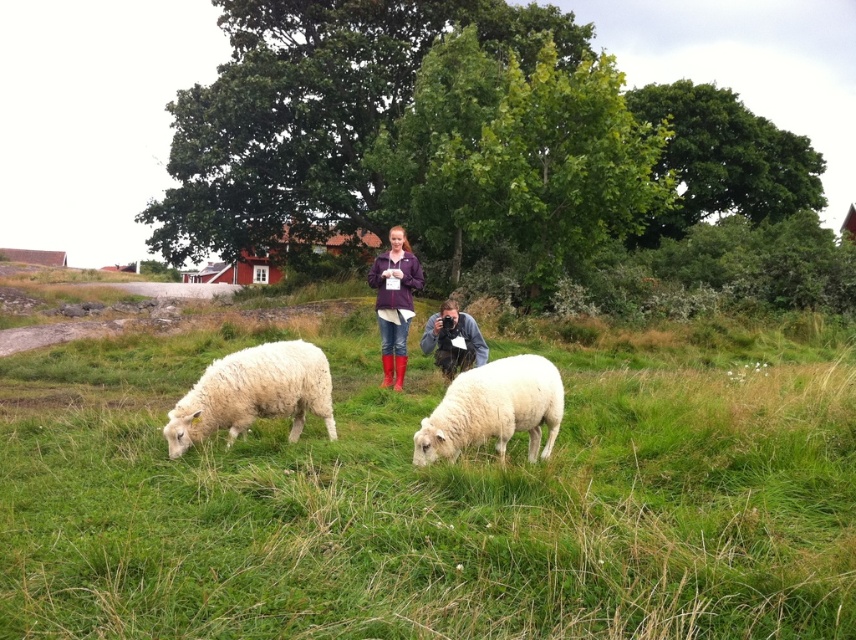
You are standing in the field and see two points marked in the scene. Which point is closer to you, point (274, 614) or point (302, 424)?

Point (274, 614) is in front of point (302, 424), so it is closer to you.